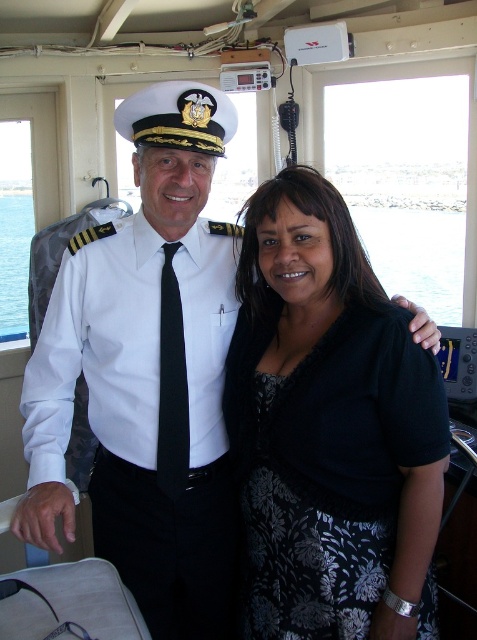
Question: Does black floral dress at center appear over blue water at center?

Choices:
 (A) no
 (B) yes

Answer: (A)

Question: Among these objects, which one is nearest to the camera?

Choices:
 (A) white cotton shirt at center
 (B) blue water at center

Answer: (A)

Question: Is white cotton shirt at center further to camera compared to blue water at center?

Choices:
 (A) yes
 (B) no

Answer: (B)

Question: Which point appears farthest from the camera in this image?

Choices:
 (A) (322, 445)
 (B) (124, 243)
 (C) (390, 284)

Answer: (C)

Question: Does black floral dress at center appear on the left side of blue water at center?

Choices:
 (A) no
 (B) yes

Answer: (B)

Question: Which point is farther to the camera?

Choices:
 (A) blue water at center
 (B) black floral dress at center

Answer: (A)